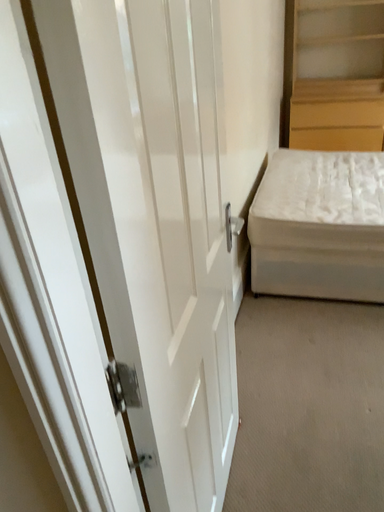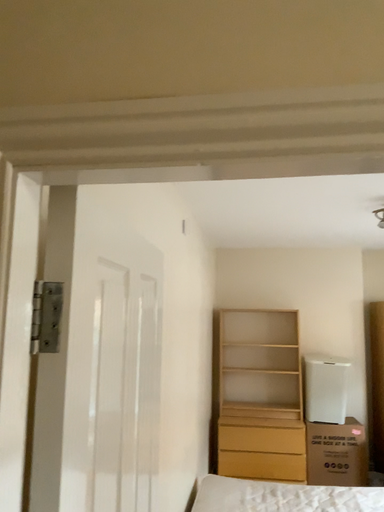
Question: Which way did the camera rotate in the video?

Choices:
 (A) rotated upward
 (B) rotated downward

Answer: (A)